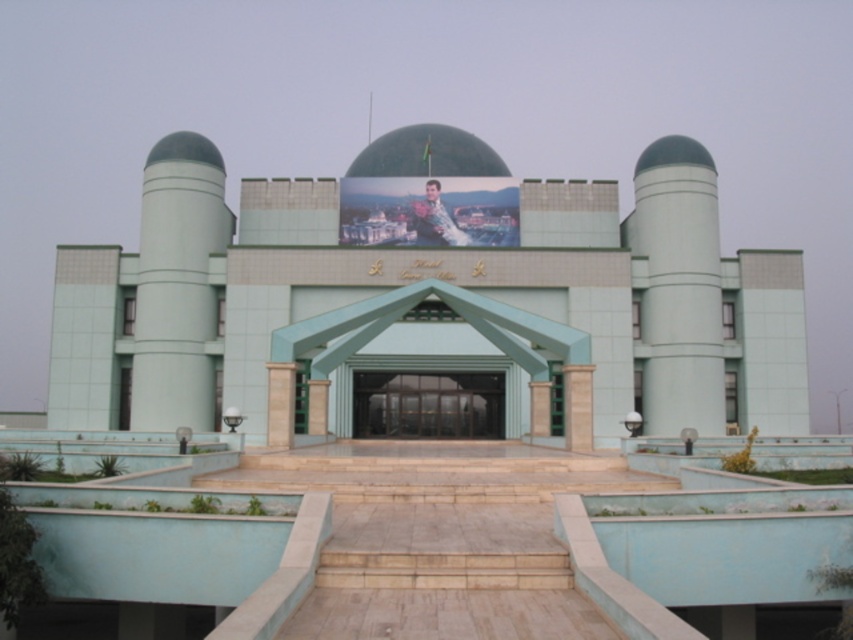
Can you confirm if light green stone building at center is positioned above green glass doors at center?

Yes.

Between light green stone building at center and green glass doors at center, which one appears on the left side from the viewer's perspective?

From the viewer's perspective, light green stone building at center appears more on the left side.

Is point (785, 332) in front of point (461, 394)?

No.

Locate an element on the screen. light green stone building at center is located at coordinates (430, 292).

Can you confirm if green concrete pillar at right is thinner than green glass doors at center?

Yes.

At what (x,y) coordinates should I click in order to perform the action: click on green concrete pillar at right. Please return your answer as a coordinate pair (x, y). The width and height of the screenshot is (853, 640). Looking at the image, I should click on (679, 285).

Can you confirm if light green concrete pillar at left is thinner than green concrete pillar at right?

No, light green concrete pillar at left is not thinner than green concrete pillar at right.

Is point (210, 202) positioned before point (697, 422)?

No, it is behind (697, 422).

I want to click on light green concrete pillar at left, so click(x=177, y=284).